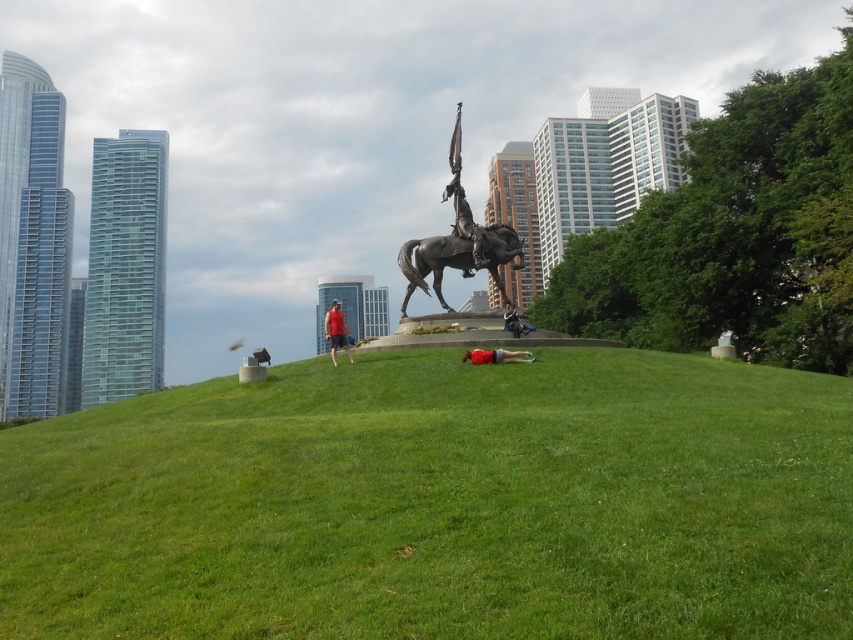
Is bronze metallic horseman at center smaller than matte red shirt at center?

Yes, bronze metallic horseman at center is smaller than matte red shirt at center.

Which is behind, point (444, 253) or point (335, 332)?

Point (444, 253)

At what (x,y) coordinates should I click in order to perform the action: click on bronze metallic horseman at center. Please return your answer as a coordinate pair (x, y). Looking at the image, I should click on (457, 241).

Can you confirm if red fabric person at center is positioned below denim jacket at center?

Yes.

Does red fabric person at center have a lesser width compared to denim jacket at center?

In fact, red fabric person at center might be wider than denim jacket at center.

Locate an element on the screen. The width and height of the screenshot is (853, 640). red fabric person at center is located at coordinates (495, 356).

Can you confirm if green grassy hill at center is smaller than polished bronze horse at center?

Incorrect, green grassy hill at center is not smaller in size than polished bronze horse at center.

In the scene shown: Does green grassy hill at center appear on the left side of polished bronze horse at center?

Yes, green grassy hill at center is to the left of polished bronze horse at center.

Between point (715, 506) and point (415, 259), which one is positioned behind?

The point (415, 259) is behind.

What are the coordinates of `green grassy hill at center` in the screenshot? It's located at (440, 502).